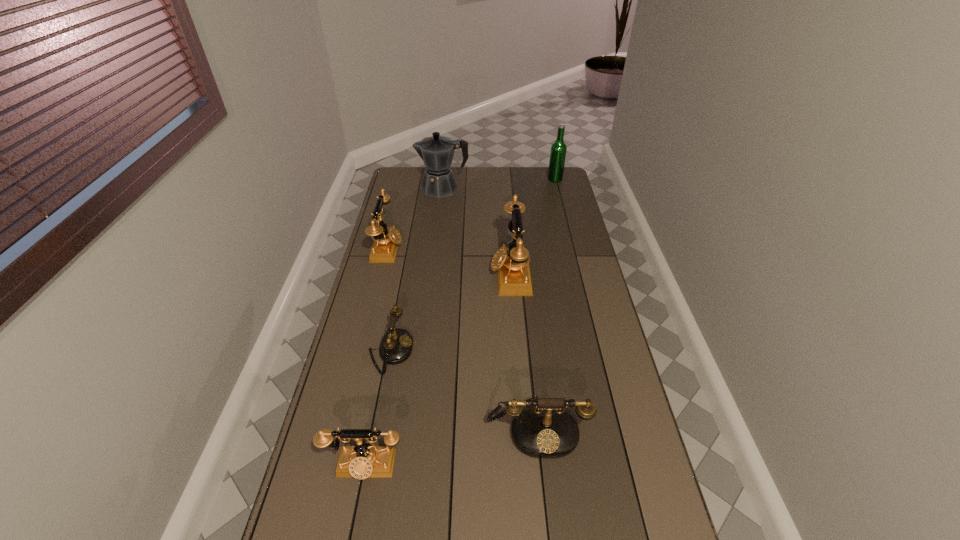
Where is `the farther black telephone`? Image resolution: width=960 pixels, height=540 pixels. the farther black telephone is located at coordinates (396, 345).

Locate an element on the screen. The width and height of the screenshot is (960, 540). the smaller black telephone is located at coordinates (396, 345).

Locate an element on the screen. This screenshot has width=960, height=540. vacant space situated on the front of the beer bottle is located at coordinates (565, 222).

The width and height of the screenshot is (960, 540). I want to click on blank space located at the spout of the coffeepot, so click(x=407, y=188).

Locate an element on the screen. free space located on the dial of the biggest beige telephone is located at coordinates (396, 273).

The width and height of the screenshot is (960, 540). I want to click on vacant region located on the dial of the biggest beige telephone, so click(391, 273).

The height and width of the screenshot is (540, 960). Identify the location of free space located 0.260m on the dial of the biggest beige telephone. (425, 273).

The height and width of the screenshot is (540, 960). In order to click on blank space located on the dial of the fourth tallest object in this screenshot , I will do `click(449, 249)`.

You are a GUI agent. You are given a task and a screenshot of the screen. Output one action in this format:
    pyautogui.click(x=<x>, y=<y>)
    Task: Click on the vacant position located 0.120m on the dial of the nearer black telephone
    This screenshot has height=540, width=960.
    Given the screenshot: What is the action you would take?
    pyautogui.click(x=545, y=507)

Identify the location of vacant space located on the dial of the nearest beige telephone. The width and height of the screenshot is (960, 540). (353, 525).